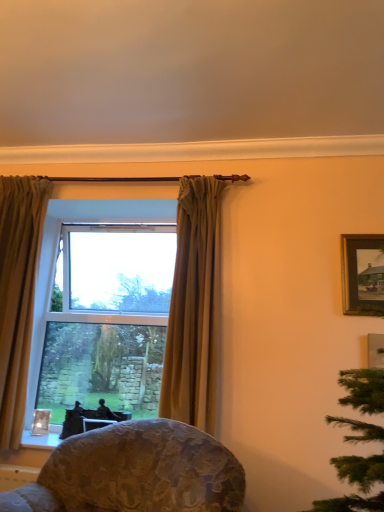
In order to face matte gold curtain at center, the 2th curtain positioned from the left, should I rotate leftwards or rightwards?

Turn right by 0.365 degrees to look at matte gold curtain at center, the 2th curtain positioned from the left.

What do you see at coordinates (362, 274) in the screenshot? The height and width of the screenshot is (512, 384). I see `wooden framed painting at upper right` at bounding box center [362, 274].

Image resolution: width=384 pixels, height=512 pixels. Find the location of `floral fabric chair at lower center`. floral fabric chair at lower center is located at coordinates (136, 472).

What are the coordinates of `matte gold curtain at center, marked as the 1th curtain in a right-to-left arrangement` in the screenshot? It's located at (194, 308).

Would you say clear glass window at center is to the left or to the right of gold textured curtain at left, the first curtain positioned from the left, in the picture?

clear glass window at center is to the right of gold textured curtain at left, the first curtain positioned from the left.

Where is `window on the right of gold textured curtain at left, arranged as the 2th curtain when viewed from the right`? The height and width of the screenshot is (512, 384). window on the right of gold textured curtain at left, arranged as the 2th curtain when viewed from the right is located at coordinates (18, 293).

How distant is clear glass window at center from gold textured curtain at left, the first curtain positioned from the left?

clear glass window at center and gold textured curtain at left, the first curtain positioned from the left, are 0.46 inches apart.

Between clear glass window at center and gold textured curtain at left, arranged as the 2th curtain when viewed from the right, which one has more height?

gold textured curtain at left, arranged as the 2th curtain when viewed from the right, is taller.

Between wooden framed painting at upper right and matte gold curtain at center, the 2th curtain positioned from the left, which one has more height?

Standing taller between the two is matte gold curtain at center, the 2th curtain positioned from the left.

Can you confirm if wooden framed painting at upper right is positioned to the left of matte gold curtain at center, marked as the 1th curtain in a right-to-left arrangement?

No.

From the image's perspective, which is below, wooden framed painting at upper right or matte gold curtain at center, the 2th curtain positioned from the left?

matte gold curtain at center, the 2th curtain positioned from the left, from the image's perspective.

Which object is closer to the camera taking this photo, wooden framed painting at upper right or matte gold curtain at center, the 2th curtain positioned from the left?

matte gold curtain at center, the 2th curtain positioned from the left.

Who is more distant, gold textured curtain at left, the first curtain positioned from the left, or matte gold curtain at center, marked as the 1th curtain in a right-to-left arrangement?

gold textured curtain at left, the first curtain positioned from the left, is more distant.

Is gold textured curtain at left, the first curtain positioned from the left, taller or shorter than matte gold curtain at center, marked as the 1th curtain in a right-to-left arrangement?

Considering their sizes, gold textured curtain at left, the first curtain positioned from the left, has more height than matte gold curtain at center, marked as the 1th curtain in a right-to-left arrangement.

Considering the relative sizes of gold textured curtain at left, arranged as the 2th curtain when viewed from the right, and matte gold curtain at center, the 2th curtain positioned from the left, in the image provided, is gold textured curtain at left, arranged as the 2th curtain when viewed from the right, bigger than matte gold curtain at center, the 2th curtain positioned from the left,?

Correct, gold textured curtain at left, arranged as the 2th curtain when viewed from the right, is larger in size than matte gold curtain at center, the 2th curtain positioned from the left.

From a real-world perspective, which is physically below, gold textured curtain at left, arranged as the 2th curtain when viewed from the right, or matte gold curtain at center, marked as the 1th curtain in a right-to-left arrangement?

gold textured curtain at left, arranged as the 2th curtain when viewed from the right, from a real-world perspective.

Is matte gold curtain at center, the 2th curtain positioned from the left, positioned far away from floral fabric chair at lower center?

That's not correct — matte gold curtain at center, the 2th curtain positioned from the left, is a little close to floral fabric chair at lower center.

Considering the positions of objects matte gold curtain at center, marked as the 1th curtain in a right-to-left arrangement, and floral fabric chair at lower center in the image provided, who is in front, matte gold curtain at center, marked as the 1th curtain in a right-to-left arrangement, or floral fabric chair at lower center?

floral fabric chair at lower center is in front.

Is matte gold curtain at center, the 2th curtain positioned from the left, smaller than floral fabric chair at lower center?

Yes.

Looking at this image, from a real-world perspective, between matte gold curtain at center, the 2th curtain positioned from the left, and floral fabric chair at lower center, who is vertically lower?

floral fabric chair at lower center, from a real-world perspective.

Where is `chair below the gold textured curtain at left, the first curtain positioned from the left (from the image's perspective)`? chair below the gold textured curtain at left, the first curtain positioned from the left (from the image's perspective) is located at coordinates (136, 472).

Which is more to the right, gold textured curtain at left, arranged as the 2th curtain when viewed from the right, or floral fabric chair at lower center?

floral fabric chair at lower center.

From a real-world perspective, who is located higher, gold textured curtain at left, arranged as the 2th curtain when viewed from the right, or floral fabric chair at lower center?

From a 3D spatial view, gold textured curtain at left, arranged as the 2th curtain when viewed from the right, is above.

Is clear glass window at center oriented away from wooden framed painting at upper right?

No, wooden framed painting at upper right is not at the back of clear glass window at center.

From the image's perspective, is clear glass window at center under wooden framed painting at upper right?

Yes.

Which of these two, clear glass window at center or wooden framed painting at upper right, is thinner?

wooden framed painting at upper right is thinner.

Consider the image. Is the depth of clear glass window at center greater than that of wooden framed painting at upper right?

That is True.

Identify the location of picture frame above the floral fabric chair at lower center (from the image's perspective). This screenshot has width=384, height=512. [x=362, y=274].

From the image's perspective, is floral fabric chair at lower center above or below wooden framed painting at upper right?

floral fabric chair at lower center is below wooden framed painting at upper right.

In terms of height, does floral fabric chair at lower center look taller or shorter compared to wooden framed painting at upper right?

Considering their sizes, floral fabric chair at lower center has more height than wooden framed painting at upper right.

Is floral fabric chair at lower center looking in the opposite direction of wooden framed painting at upper right?

No, wooden framed painting at upper right is not at the back of floral fabric chair at lower center.

The width and height of the screenshot is (384, 512). Find the location of `window behind the gold textured curtain at left, arranged as the 2th curtain when viewed from the right`. window behind the gold textured curtain at left, arranged as the 2th curtain when viewed from the right is located at coordinates (18, 293).

You are a GUI agent. You are given a task and a screenshot of the screen. Output one action in this format:
    pyautogui.click(x=<x>, y=<y>)
    Task: Click on the picture frame located above the matte gold curtain at center, the 2th curtain positioned from the left (from the image's perspective)
    This screenshot has width=384, height=512.
    Given the screenshot: What is the action you would take?
    (362, 274)

Considering their positions, is clear glass window at center positioned closer to wooden framed painting at upper right than floral fabric chair at lower center?

floral fabric chair at lower center.

When comparing their distances from matte gold curtain at center, marked as the 1th curtain in a right-to-left arrangement, does wooden framed painting at upper right or clear glass window at center seem further?

clear glass window at center is further to matte gold curtain at center, marked as the 1th curtain in a right-to-left arrangement.

Estimate the real-world distances between objects in this image. Which object is further from floral fabric chair at lower center, clear glass window at center or wooden framed painting at upper right?

wooden framed painting at upper right.

When comparing their distances from clear glass window at center, does matte gold curtain at center, the 2th curtain positioned from the left, or wooden framed painting at upper right seem closer?

matte gold curtain at center, the 2th curtain positioned from the left, is closer to clear glass window at center.

Estimate the real-world distances between objects in this image. Which object is closer to floral fabric chair at lower center, clear glass window at center or gold textured curtain at left, arranged as the 2th curtain when viewed from the right?

The object closer to floral fabric chair at lower center is clear glass window at center.

Based on their spatial positions, is matte gold curtain at center, the 2th curtain positioned from the left, or gold textured curtain at left, the first curtain positioned from the left, closer to floral fabric chair at lower center?

matte gold curtain at center, the 2th curtain positioned from the left.

Which object lies further to the anchor point matte gold curtain at center, marked as the 1th curtain in a right-to-left arrangement, gold textured curtain at left, arranged as the 2th curtain when viewed from the right, or floral fabric chair at lower center?

gold textured curtain at left, arranged as the 2th curtain when viewed from the right.

Which object lies further to the anchor point clear glass window at center, wooden framed painting at upper right or gold textured curtain at left, arranged as the 2th curtain when viewed from the right?

Among the two, wooden framed painting at upper right is located further to clear glass window at center.

What are the coordinates of `chair situated between gold textured curtain at left, arranged as the 2th curtain when viewed from the right, and wooden framed painting at upper right from left to right` in the screenshot? It's located at (x=136, y=472).

The width and height of the screenshot is (384, 512). In order to click on curtain between gold textured curtain at left, the first curtain positioned from the left, and wooden framed painting at upper right, in the horizontal direction in this screenshot , I will do `click(194, 308)`.

Locate an element on the screen. This screenshot has height=512, width=384. curtain between floral fabric chair at lower center and gold textured curtain at left, arranged as the 2th curtain when viewed from the right, from front to back is located at coordinates (194, 308).

The image size is (384, 512). I want to click on curtain located between floral fabric chair at lower center and wooden framed painting at upper right in the depth direction, so click(x=194, y=308).